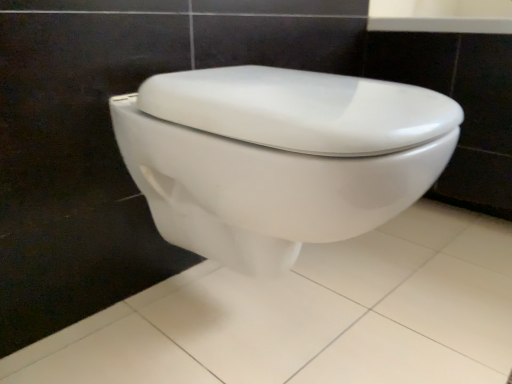
Find the location of a particular element. white glossy toilet at center is located at coordinates (311, 316).

This screenshot has height=384, width=512. Describe the element at coordinates (311, 316) in the screenshot. I see `white glossy toilet at center` at that location.

At what (x,y) coordinates should I click in order to perform the action: click on white glossy toilet at center. Please return your answer as a coordinate pair (x, y). Looking at the image, I should click on (278, 157).

Describe the element at coordinates (278, 157) in the screenshot. I see `white glossy toilet at center` at that location.

In order to face white glossy toilet at center, should I rotate leftwards or rightwards?

You should rotate right by 3.241 degrees.

Where is `white glossy toilet at center`? The image size is (512, 384). white glossy toilet at center is located at coordinates (311, 316).

Would you say white glossy toilet at center is to the left or to the right of white glossy toilet at center in the picture?

white glossy toilet at center is to the left of white glossy toilet at center.

Which object is closer to the camera taking this photo, white glossy toilet at center or white glossy toilet at center?

white glossy toilet at center is in front.

Does point (355, 98) come closer to viewer compared to point (77, 351)?

Yes.

From the image's perspective, is white glossy toilet at center over white glossy toilet at center?

Yes, from the image's perspective, white glossy toilet at center is over white glossy toilet at center.

From a real-world perspective, relative to white glossy toilet at center, is white glossy toilet at center vertically above or below?

From a real-world perspective, white glossy toilet at center is physically above white glossy toilet at center.

Can you confirm if white glossy toilet at center is wider than white glossy toilet at center?

Incorrect, the width of white glossy toilet at center does not surpass that of white glossy toilet at center.

Does white glossy toilet at center have a greater height compared to white glossy toilet at center?

Indeed, white glossy toilet at center has a greater height compared to white glossy toilet at center.

Does white glossy toilet at center have a smaller size compared to white glossy toilet at center?

No, white glossy toilet at center is not smaller than white glossy toilet at center.

Does white glossy toilet at center contain white glossy toilet at center?

No.

Does white glossy toilet at center touch white glossy toilet at center?

They are not placed beside each other.

Is white glossy toilet at center facing away from white glossy toilet at center?

white glossy toilet at center does not have its back to white glossy toilet at center.

In the image, there is a white glossy toilet at center. Where is `porcelain below it (from a real-world perspective)`? The image size is (512, 384). porcelain below it (from a real-world perspective) is located at coordinates (311, 316).

Which is more to the right, white glossy toilet at center or white glossy toilet at center?

From the viewer's perspective, white glossy toilet at center appears more on the right side.

Considering the positions of objects white glossy toilet at center and white glossy toilet at center in the image provided, who is behind, white glossy toilet at center or white glossy toilet at center?

white glossy toilet at center is further away from the camera.

Does point (71, 329) come behind point (280, 121)?

Yes, point (71, 329) is behind point (280, 121).

From the image's perspective, is white glossy toilet at center on white glossy toilet at center?

No, from the image's perspective, white glossy toilet at center is not above white glossy toilet at center.

From a real-world perspective, is white glossy toilet at center above or below white glossy toilet at center?

From a real-world perspective, white glossy toilet at center is physically below white glossy toilet at center.

Can you confirm if white glossy toilet at center is wider than white glossy toilet at center?

Yes.

Considering the sizes of objects white glossy toilet at center and white glossy toilet at center in the image provided, who is shorter, white glossy toilet at center or white glossy toilet at center?

white glossy toilet at center.

In terms of size, does white glossy toilet at center appear bigger or smaller than white glossy toilet at center?

Clearly, white glossy toilet at center is smaller in size than white glossy toilet at center.

Is white glossy toilet at center inside the boundaries of white glossy toilet at center, or outside?

white glossy toilet at center is outside white glossy toilet at center.

Is white glossy toilet at center far from white glossy toilet at center?

That's not correct — white glossy toilet at center is a little close to white glossy toilet at center.

Is white glossy toilet at center aimed at white glossy toilet at center?

No.

How many degrees apart are the facing directions of white glossy toilet at center and white glossy toilet at center?

The angular difference between white glossy toilet at center and white glossy toilet at center is 90.4 degrees.

Measure the distance between white glossy toilet at center and white glossy toilet at center.

The distance of white glossy toilet at center from white glossy toilet at center is 12.29 inches.

Identify the location of toilet above the white glossy toilet at center (from a real-world perspective). The width and height of the screenshot is (512, 384). (278, 157).

Find the location of a particular element. The height and width of the screenshot is (384, 512). toilet on the left of white glossy toilet at center is located at coordinates (278, 157).

You are a GUI agent. You are given a task and a screenshot of the screen. Output one action in this format:
    pyautogui.click(x=<x>, y=<y>)
    Task: Click on the toilet above the white glossy toilet at center (from a real-world perspective)
    The width and height of the screenshot is (512, 384).
    Given the screenshot: What is the action you would take?
    pyautogui.click(x=278, y=157)